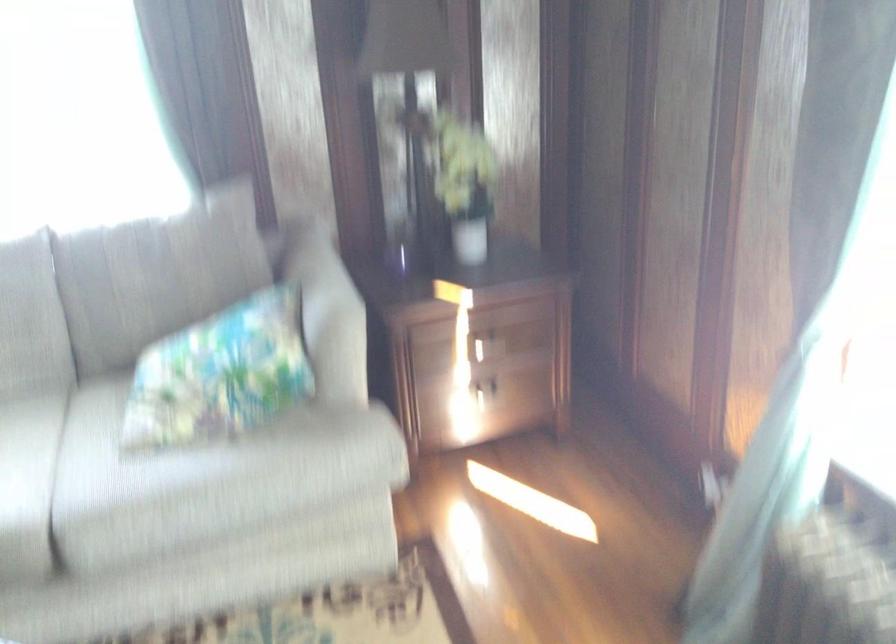
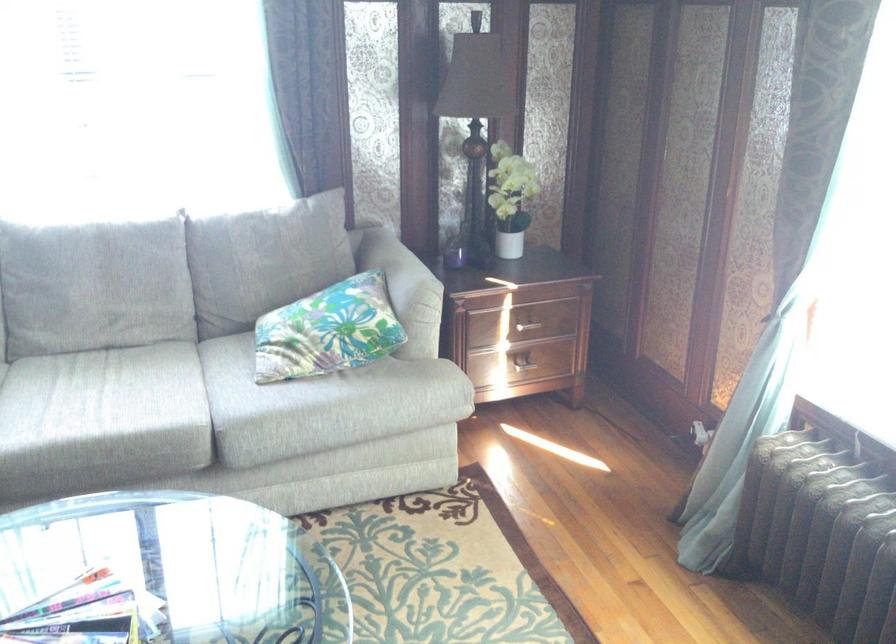
Find the pixel in the second image that matches (x=330, y=303) in the first image.

(409, 279)